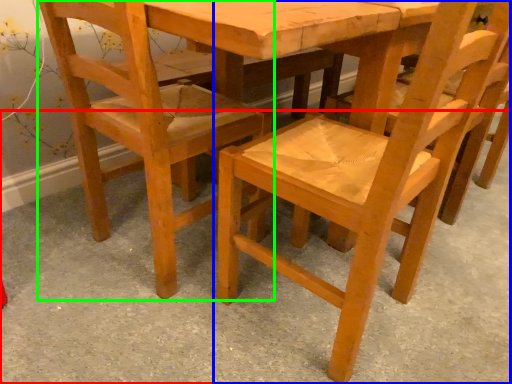
Question: Estimate the real-world distances between objects in this image. Which object is closer to concrete (highlighted by a red box), chair (highlighted by a blue box) or chair (highlighted by a green box)?

Choices:
 (A) chair
 (B) chair

Answer: (A)